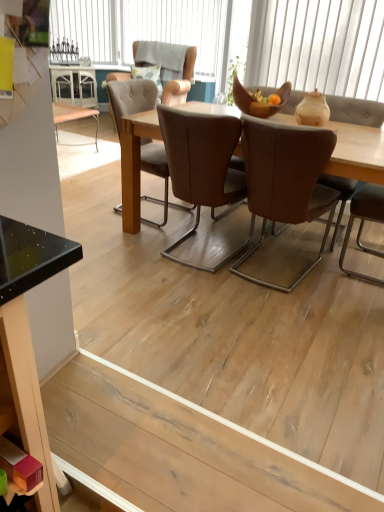
Question: Would you say matte black desk at lower left contains light brown leather chair at upper center, which is counted as the third chair, starting from the front?

Choices:
 (A) no
 (B) yes

Answer: (A)

Question: Is light brown leather chair at upper center, which is counted as the third chair, starting from the front, at the back of matte black desk at lower left?

Choices:
 (A) yes
 (B) no

Answer: (B)

Question: Is matte black desk at lower left thinner than light brown leather chair at upper center, which ranks as the first chair in back-to-front order?

Choices:
 (A) yes
 (B) no

Answer: (A)

Question: From a real-world perspective, is matte black desk at lower left below light brown leather chair at upper center, acting as the 1th chair starting from the top?

Choices:
 (A) yes
 (B) no

Answer: (A)

Question: Considering the relative sizes of matte black desk at lower left and light brown leather chair at upper center, which is counted as the third chair, starting from the front, in the image provided, is matte black desk at lower left shorter than light brown leather chair at upper center, which is counted as the third chair, starting from the front,?

Choices:
 (A) no
 (B) yes

Answer: (B)

Question: From the image's perspective, is brown leather chair at center, which ranks as the 2th chair in front-to-back order, positioned above or below natural wood floor at lower center?

Choices:
 (A) above
 (B) below

Answer: (A)

Question: Considering their positions, is brown leather chair at center, which ranks as the 2th chair in front-to-back order, located in front of or behind natural wood floor at lower center?

Choices:
 (A) behind
 (B) front

Answer: (A)

Question: Considering the positions of brown leather chair at center, the second chair from the top, and natural wood floor at lower center in the image, is brown leather chair at center, the second chair from the top, taller or shorter than natural wood floor at lower center?

Choices:
 (A) tall
 (B) short

Answer: (A)

Question: Is point (192, 134) positioned closer to the camera than point (261, 458)?

Choices:
 (A) farther
 (B) closer

Answer: (A)

Question: Do you think brown leather chair at center, the third chair viewed from the back, is within white textured cushion at upper center, acting as the second window starting from the top, or outside of it?

Choices:
 (A) inside
 (B) outside

Answer: (B)

Question: Is point (337, 193) closer or farther from the camera than point (89, 31)?

Choices:
 (A) farther
 (B) closer

Answer: (B)

Question: Would you say brown leather chair at center, the third chair from the top, is to the left or to the right of white textured cushion at upper center, the 2th window positioned from the left, in the picture?

Choices:
 (A) right
 (B) left

Answer: (A)

Question: Considering the positions of brown leather chair at center, the third chair from the top, and white textured cushion at upper center, the 2th window positioned from the left, in the image, is brown leather chair at center, the third chair from the top, wider or thinner than white textured cushion at upper center, the 2th window positioned from the left,?

Choices:
 (A) thin
 (B) wide

Answer: (B)

Question: From the image's perspective, is white textured window at upper center, which is the 1th window in bottom-to-top order, located above or below light brown leather chair at upper center, acting as the 1th chair starting from the top?

Choices:
 (A) above
 (B) below

Answer: (B)

Question: Is white textured window at upper center, which is counted as the 1th window, starting from the right, in front of or behind light brown leather chair at upper center, the 3th chair when ordered from bottom to top, in the image?

Choices:
 (A) front
 (B) behind

Answer: (A)